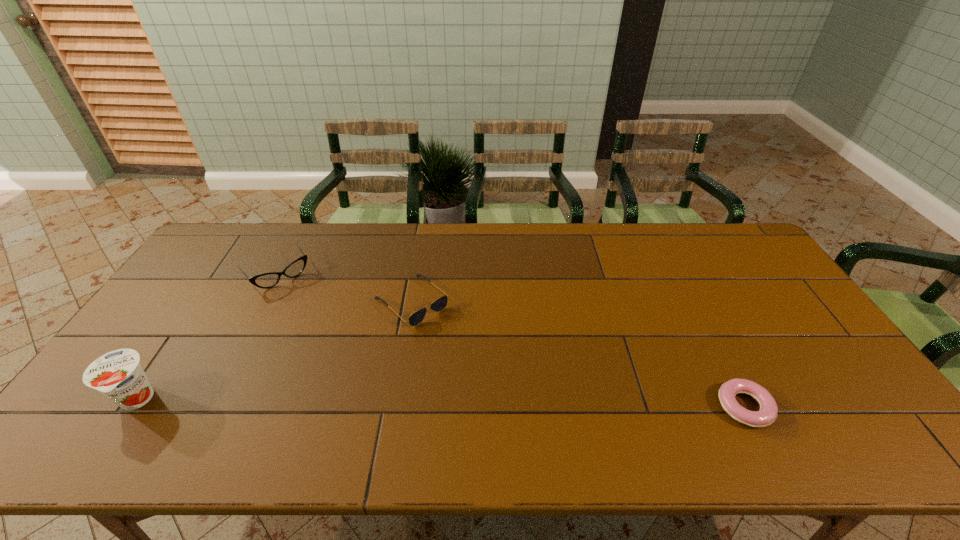
Locate an element on the screen. the leftmost object is located at coordinates (118, 375).

Image resolution: width=960 pixels, height=540 pixels. Find the location of `the tallest object`. the tallest object is located at coordinates (118, 375).

Locate an element on the screen. The height and width of the screenshot is (540, 960). doughnut is located at coordinates (767, 414).

Identify the location of the shortest object. Image resolution: width=960 pixels, height=540 pixels. (767, 414).

Locate an element on the screen. This screenshot has height=540, width=960. the second shortest object is located at coordinates (416, 318).

Where is `sunglasses`? sunglasses is located at coordinates (416, 318).

Find the location of `the third shortest object`. the third shortest object is located at coordinates (267, 280).

The image size is (960, 540). In order to click on spectacles in this screenshot , I will do `click(267, 280)`.

At what (x,y) coordinates should I click in order to perform the action: click on vacant space located 0.370m on the back of the tallest object. Please return your answer as a coordinate pair (x, y). The width and height of the screenshot is (960, 540). Looking at the image, I should click on coord(215,283).

At what (x,y) coordinates should I click in order to perform the action: click on vacant point located 0.090m on the right of the doughnut. Please return your answer as a coordinate pair (x, y). This screenshot has height=540, width=960. Looking at the image, I should click on click(807, 407).